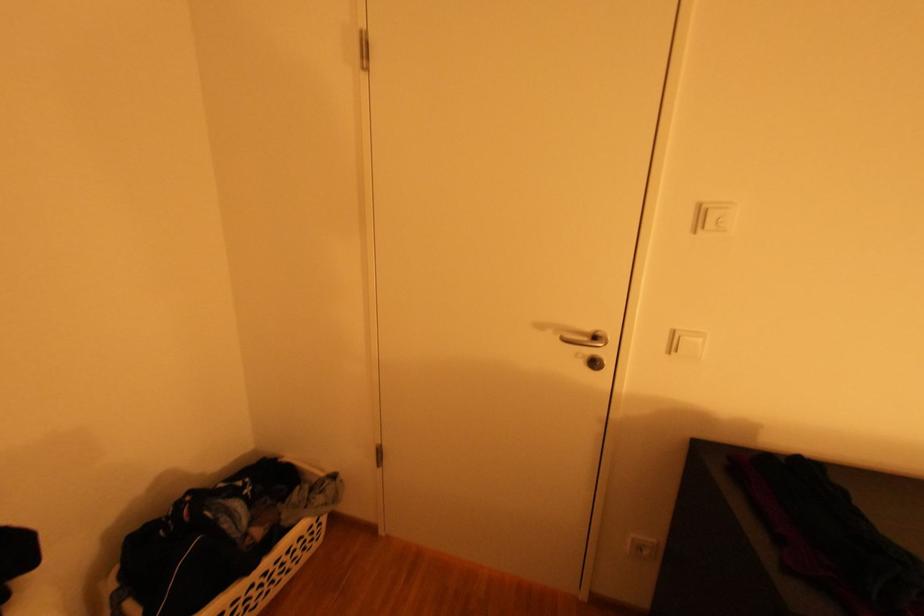
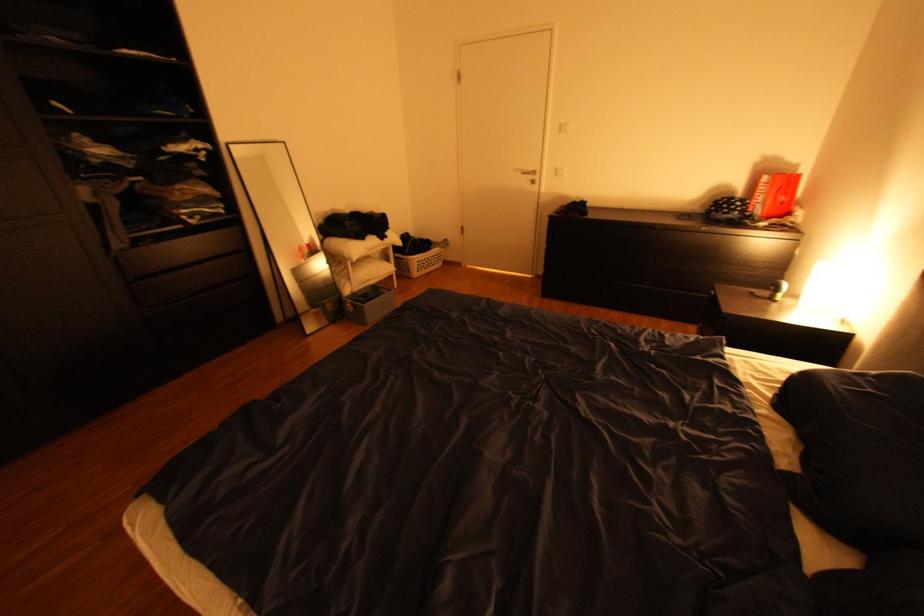
In the second image, find the point that corresponds to point (550, 328) in the first image.

(526, 171)